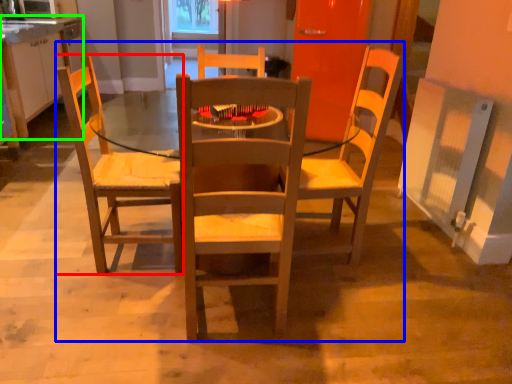
Question: Based on their relative distances, which object is farther from chair (highlighted by a red box)? Choose from trio (highlighted by a blue box) and cabinetry (highlighted by a green box).

Choices:
 (A) trio
 (B) cabinetry

Answer: (B)